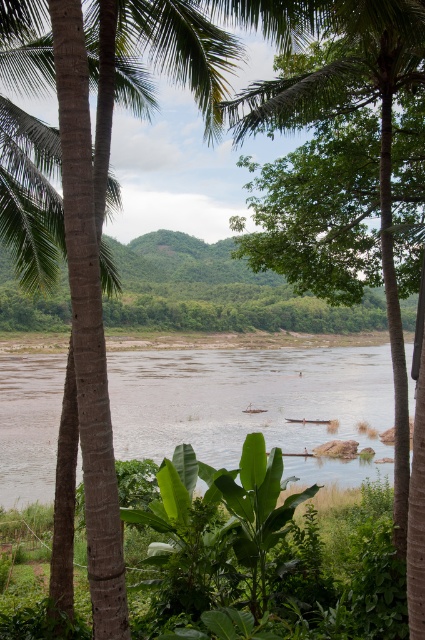
Between green leafy palm tree at center and green textured palm tree at left, which one appears on the left side from the viewer's perspective?

Positioned to the left is green textured palm tree at left.

Can you confirm if green leafy palm tree at center is smaller than green textured palm tree at left?

Actually, green leafy palm tree at center might be larger than green textured palm tree at left.

Who is more forward, (x=408, y=560) or (x=28, y=131)?

Point (x=408, y=560) is more forward.

This screenshot has width=425, height=640. What are the coordinates of `green leafy palm tree at center` in the screenshot? It's located at (348, 188).

This screenshot has height=640, width=425. Describe the element at coordinates (348, 188) in the screenshot. I see `green leafy palm tree at center` at that location.

In the scene shown: Is green leafy palm tree at center below brown muddy water at center?

No, green leafy palm tree at center is not below brown muddy water at center.

I want to click on green leafy palm tree at center, so click(348, 188).

Can you confirm if brown muddy water at center is positioned to the right of green textured palm tree at left?

In fact, brown muddy water at center is to the left of green textured palm tree at left.

Can you confirm if brown muddy water at center is positioned to the left of green textured palm tree at left?

Correct, you'll find brown muddy water at center to the left of green textured palm tree at left.

Who is more distant from viewer, (x=289, y=388) or (x=48, y=253)?

The point (x=289, y=388) is more distant.

You are a GUI agent. You are given a task and a screenshot of the screen. Output one action in this format:
    pyautogui.click(x=<x>, y=<y>)
    Task: Click on the brown muddy water at center
    This screenshot has width=425, height=640.
    Given the screenshot: What is the action you would take?
    pyautogui.click(x=246, y=397)